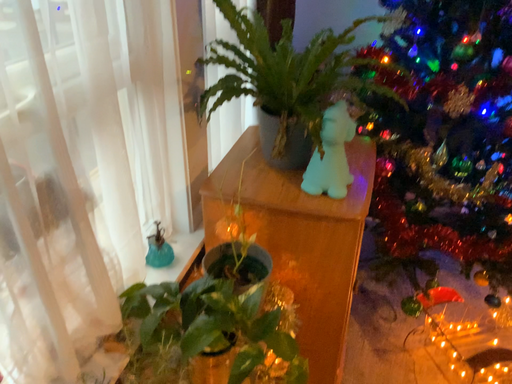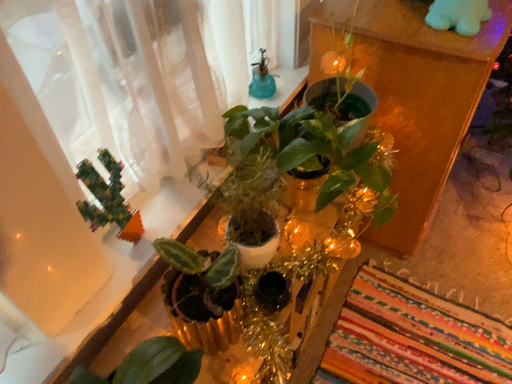
Question: Which way did the camera rotate in the video?

Choices:
 (A) rotated right
 (B) rotated left

Answer: (B)